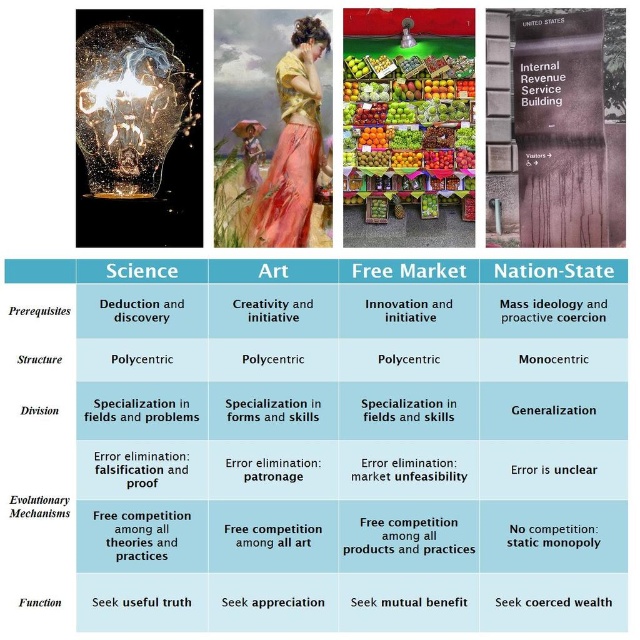
You are an interior designer assessing the lighting in a modern living room. You see the translucent glass bulb at upper left and the matte silver lamp at center. Which object would cast a broader light spread due to its size?

The translucent glass bulb at upper left is larger in size than the matte silver lamp at center, so it would cast a broader light spread.